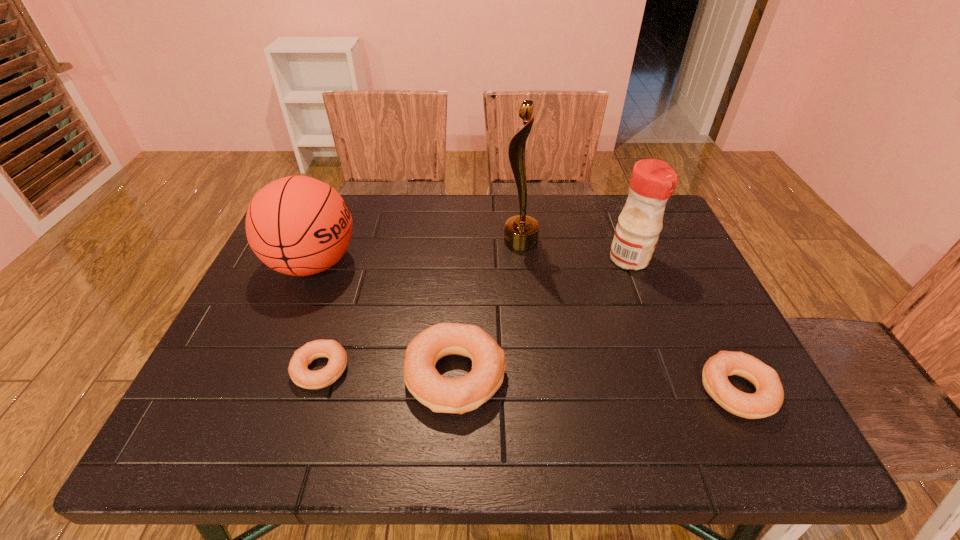
If the aim is uniform spacing by inserting an additional bagel among them, please point to a vacant space for this new bagel. Please provide its 2D coordinates. Your answer should be formatted as a tuple, i.e. [(x, y)], where the tuple contains the x and y coordinates of a point satisfying the conditions above.

[(594, 383)]